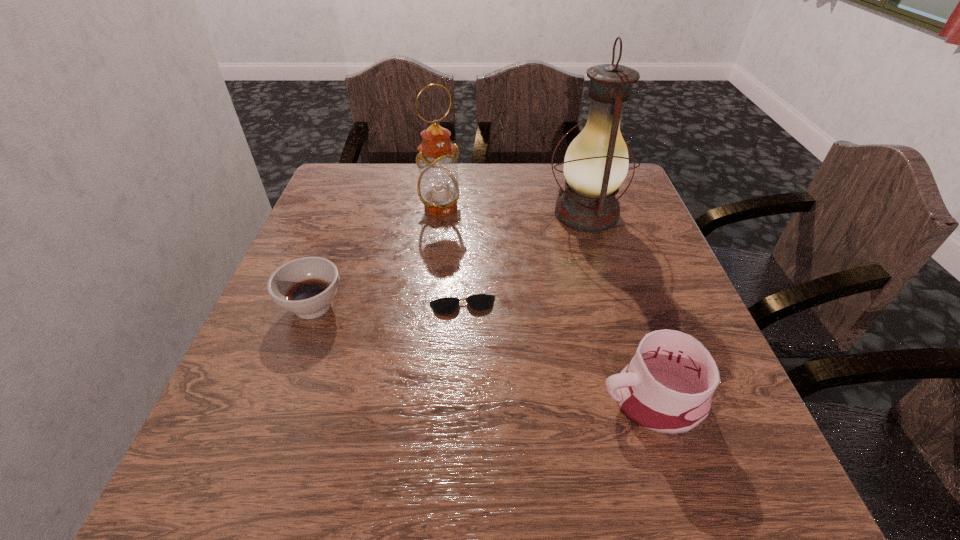
At what (x,y) coordinates should I click in order to perform the action: click on the tallest object. Please return your answer as a coordinate pair (x, y). Looking at the image, I should click on pos(596,163).

Identify the location of the right oil lamp. The width and height of the screenshot is (960, 540). (596, 163).

Identify the location of the left oil lamp. (438, 185).

Identify the location of the fourth shortest object. (438, 185).

The image size is (960, 540). What are the coordinates of `the third tallest object` in the screenshot? It's located at (667, 387).

Image resolution: width=960 pixels, height=540 pixels. In order to click on the nearest object in this screenshot , I will do `click(667, 387)`.

Find the location of a particular element. The image size is (960, 540). soup bowl is located at coordinates (306, 286).

Where is `the leftmost object`? The width and height of the screenshot is (960, 540). the leftmost object is located at coordinates (306, 286).

You are a GUI agent. You are given a task and a screenshot of the screen. Output one action in this format:
    pyautogui.click(x=<x>, y=<y>)
    Task: Click on the shortest object
    The image size is (960, 540).
    Given the screenshot: What is the action you would take?
    pyautogui.click(x=479, y=302)

Image resolution: width=960 pixels, height=540 pixels. I want to click on vacant space located on the front of the right oil lamp, so click(x=625, y=343).